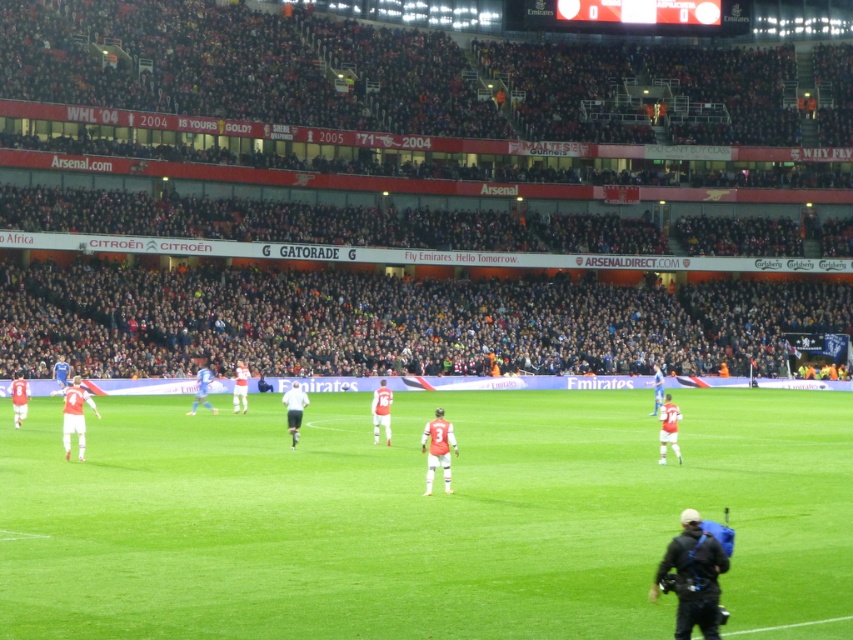
Question: Which object appears farthest from the camera in this image?

Choices:
 (A) white matte shirt at center
 (B) blue jersey at center
 (C) dark gray crowd at center
 (D) green grass field at center

Answer: (C)

Question: Does white matte shirt at center lie behind blue jersey at center?

Choices:
 (A) yes
 (B) no

Answer: (B)

Question: Does dark gray crowd at center appear over blue jersey at center?

Choices:
 (A) yes
 (B) no

Answer: (A)

Question: Based on their relative distances, which object is nearer to the black fabric camera at lower right?

Choices:
 (A) white matte shirt at center
 (B) blue jersey at center

Answer: (A)

Question: Can you confirm if black fabric camera at lower right is wider than white matte shirt at center?

Choices:
 (A) no
 (B) yes

Answer: (A)

Question: Which object is positioned farthest from the blue jersey at center?

Choices:
 (A) white matte shirt at center
 (B) black fabric camera at lower right
 (C) dark gray crowd at center

Answer: (B)